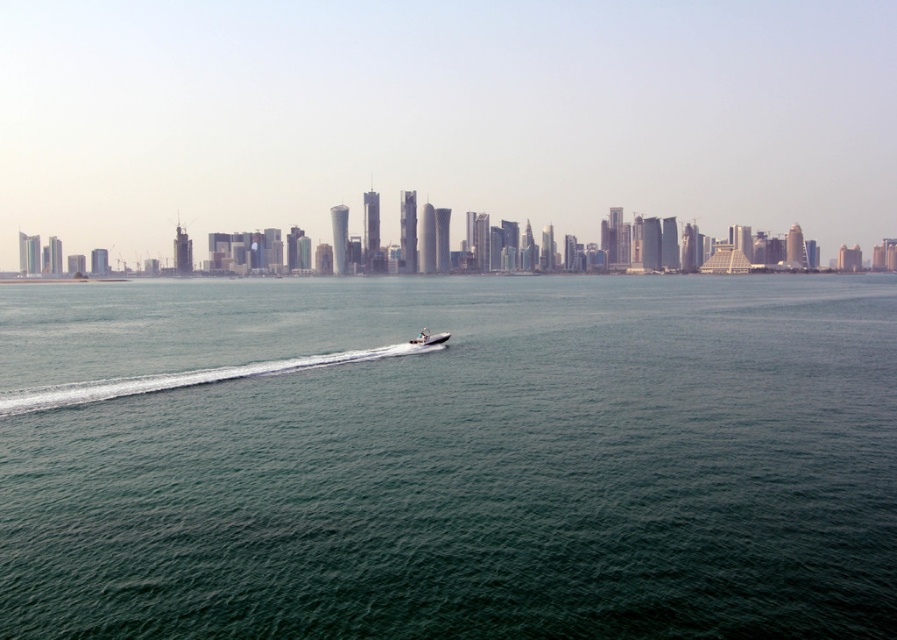
Consider the image. Measure the distance between green water at center and white glossy boat at center.

The distance of green water at center from white glossy boat at center is 354.71 feet.

Does green water at center appear over white glossy boat at center?

Yes, green water at center is above white glossy boat at center.

Is point (221, 452) farther from camera compared to point (425, 330)?

No.

What are the coordinates of `green water at center` in the screenshot? It's located at (449, 458).